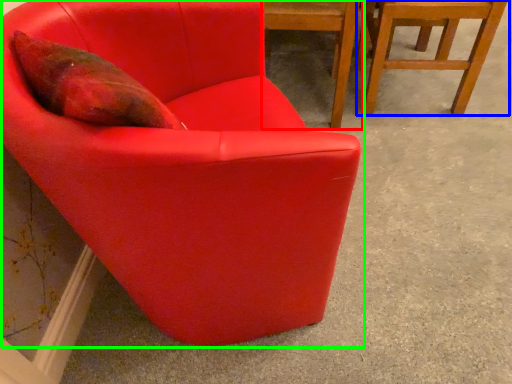
Question: Which object is the closest to the chair (highlighted by a red box)? Choose among these: chair (highlighted by a blue box) or chair (highlighted by a green box).

Choices:
 (A) chair
 (B) chair

Answer: (A)